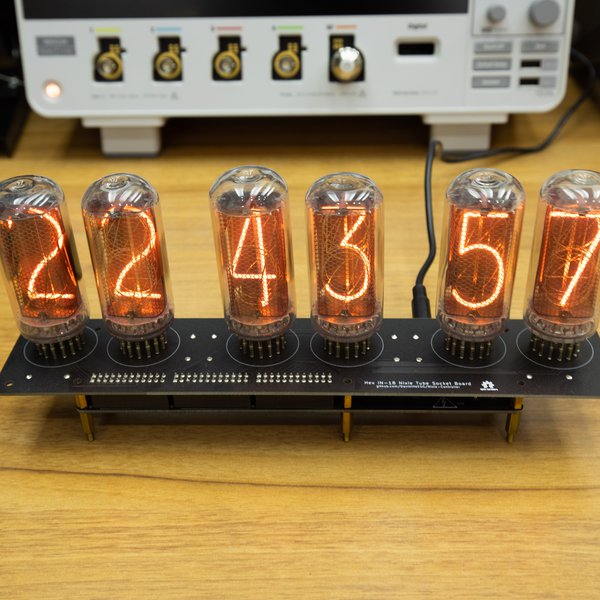
Locate an element on the screen. black plug is located at coordinates (420, 291).